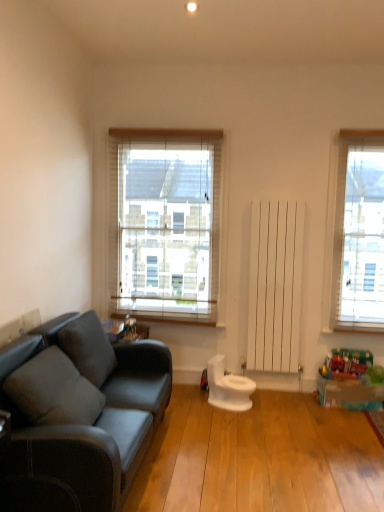
Question: Considering their positions, is translucent plastic toy at lower right, acting as the first toy starting from the bottom, located in front of or behind soft gray cushion at left, which ranks as the 2th pillow in back-to-front order?

Choices:
 (A) front
 (B) behind

Answer: (B)

Question: Is translucent plastic toy at lower right, the second toy positioned from the left, bigger or smaller than soft gray cushion at left, which ranks as the 2th pillow in back-to-front order?

Choices:
 (A) big
 (B) small

Answer: (B)

Question: Based on their relative distances, which object is nearer to the soft gray cushion at left, acting as the 1th pillow starting from the front?

Choices:
 (A) translucent plastic toy at lower right, the second toy positioned from the left
 (B) gray fabric pillow at left, marked as the second pillow in a front-to-back arrangement
 (C) white wood blinds at center
 (D) metallic silver toy at center, the first toy in the left-to-right sequence
 (E) white glossy toilet at center

Answer: (B)

Question: Which is nearer to the metallic silver toy at center, the first toy in the left-to-right sequence?

Choices:
 (A) gray fabric pillow at left, the first pillow when ordered from back to front
 (B) white wood blinds at center
 (C) translucent plastic toy at lower right, acting as the first toy starting from the bottom
 (D) white glossy toilet at center
 (E) soft gray cushion at left, acting as the 1th pillow starting from the front

Answer: (A)